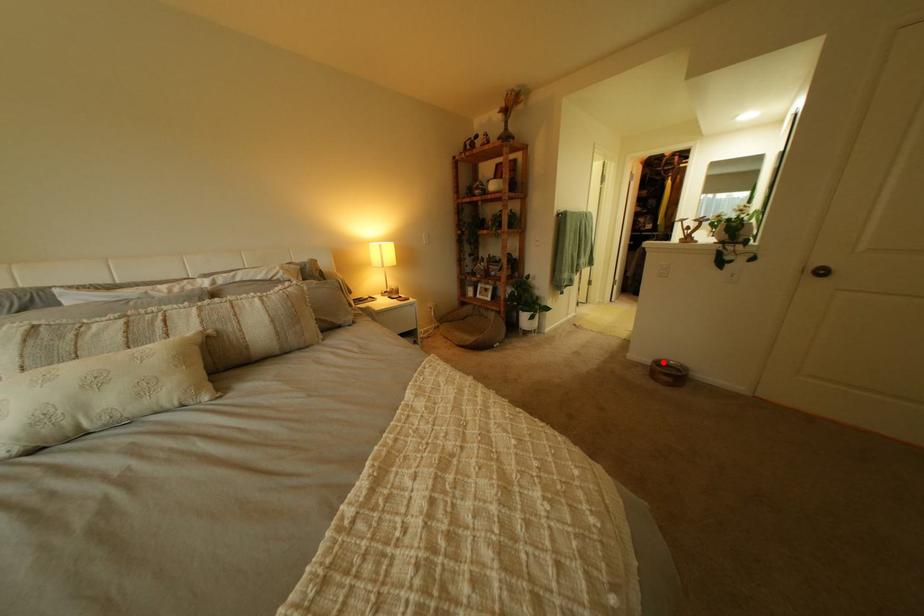
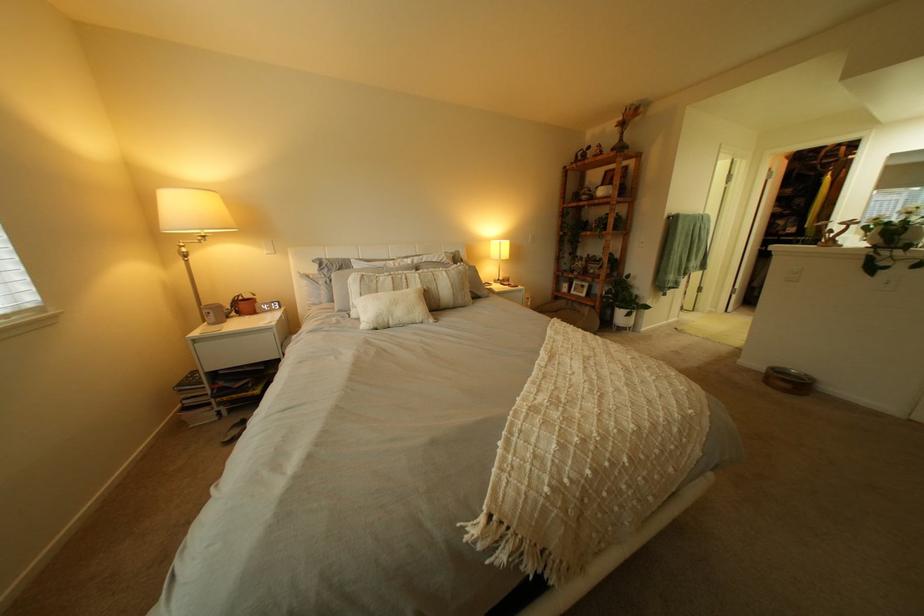
Question: I am providing you with two images of the same scene from different viewpoints. Image1 has a red point marked. In image2, the corresponding 3D location appears at what relative position? Reply with the corresponding letter.

Choices:
 (A) Closer
 (B) Farther

Answer: (B)